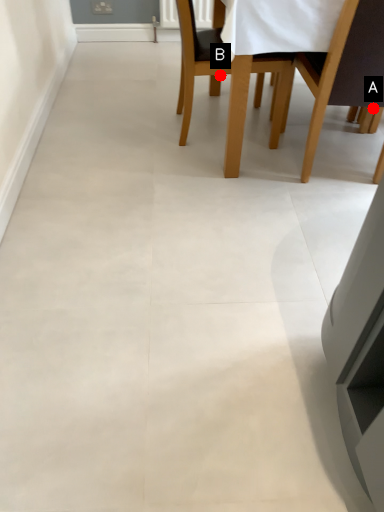
Question: Two points are circled on the image, labeled by A and B beside each circle. Which point is closer to the camera?

Choices:
 (A) A is closer
 (B) B is closer

Answer: (B)